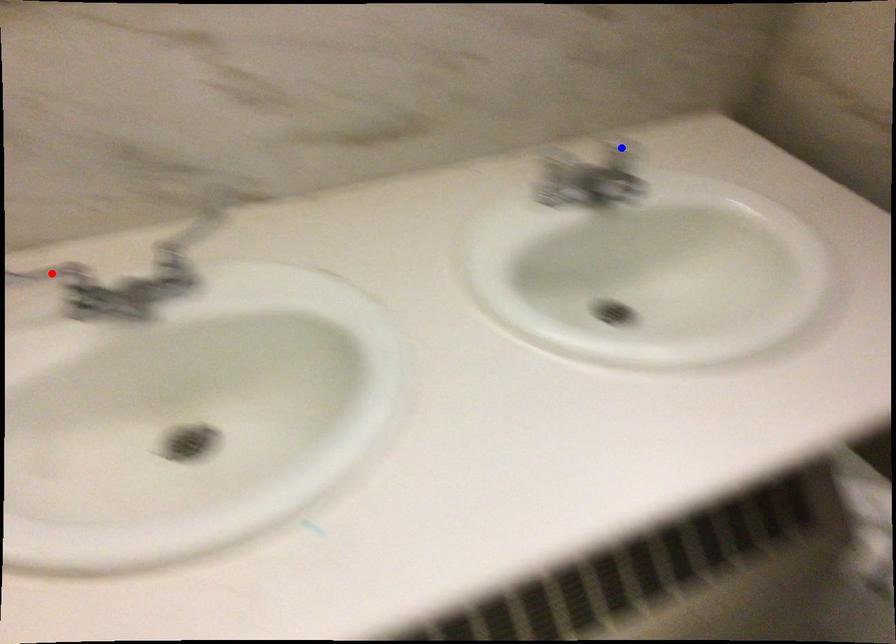
Question: Two points are marked on the image. Which point is closer to the camera?

Choices:
 (A) Blue point is closer.
 (B) Red point is closer.

Answer: (B)